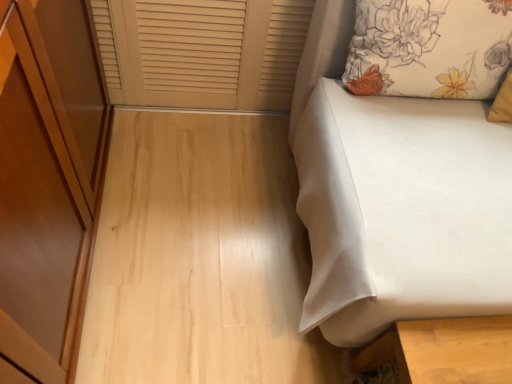
Locate an element on the screen. white fabric bed at right is located at coordinates (395, 198).

What do you see at coordinates (430, 48) in the screenshot?
I see `floral fabric pillow at upper right` at bounding box center [430, 48].

The image size is (512, 384). Identify the location of floral fabric pillow at upper right. (430, 48).

Identify the location of beige wood window frame at upper left. This screenshot has height=384, width=512. (202, 51).

Does point (432, 74) appear closer or farther from the camera than point (305, 128)?

Clearly, point (432, 74) is closer to the camera than point (305, 128).

The height and width of the screenshot is (384, 512). Identify the location of pillow to the left of white fabric bed at right. (430, 48).

Are floral fabric pillow at upper right and white fabric bed at right located far from each other?

floral fabric pillow at upper right is near white fabric bed at right, not far away.

From the image's perspective, which one is positioned higher, floral fabric pillow at upper right or white fabric bed at right?

floral fabric pillow at upper right, from the image's perspective.

Is white fabric bed at right looking in the opposite direction of beige wood window frame at upper left?

No, white fabric bed at right is not facing away from beige wood window frame at upper left.

Between white fabric bed at right and beige wood window frame at upper left, which one appears on the left side from the viewer's perspective?

beige wood window frame at upper left.

Is white fabric bed at right wider or thinner than beige wood window frame at upper left?

white fabric bed at right is wider than beige wood window frame at upper left.

Would you say white fabric bed at right contains beige wood window frame at upper left?

No, beige wood window frame at upper left is located outside of white fabric bed at right.

Is point (220, 99) positioned behind point (327, 177)?

Yes, it is behind point (327, 177).

Consider the image. Which of these two, beige wood window frame at upper left or white fabric bed at right, stands shorter?

beige wood window frame at upper left.

This screenshot has width=512, height=384. Find the location of `furniture below the beige wood window frame at upper left (from the image's perspective)`. furniture below the beige wood window frame at upper left (from the image's perspective) is located at coordinates (395, 198).

Consider the image. Is beige wood window frame at upper left in contact with white fabric bed at right?

beige wood window frame at upper left is not next to white fabric bed at right, and they're not touching.

Does beige wood window frame at upper left come behind floral fabric pillow at upper right?

Yes, it is behind floral fabric pillow at upper right.

Is beige wood window frame at upper left oriented towards floral fabric pillow at upper right?

No, beige wood window frame at upper left is not turned towards floral fabric pillow at upper right.

Looking at this image, from the image's perspective, is beige wood window frame at upper left on top of floral fabric pillow at upper right?

Indeed, from the image's perspective, beige wood window frame at upper left is shown above floral fabric pillow at upper right.

Is floral fabric pillow at upper right located within beige wood window frame at upper left?

Definitely not — floral fabric pillow at upper right is not inside beige wood window frame at upper left.

How far apart are floral fabric pillow at upper right and beige wood window frame at upper left?

The distance of floral fabric pillow at upper right from beige wood window frame at upper left is 54.91 centimeters.

Is floral fabric pillow at upper right situated inside beige wood window frame at upper left or outside?

floral fabric pillow at upper right is not inside beige wood window frame at upper left, it's outside.

How many degrees apart are the facing directions of floral fabric pillow at upper right and beige wood window frame at upper left?

floral fabric pillow at upper right and beige wood window frame at upper left are facing 2.43 degrees away from each other.

From the picture: Considering the relative sizes of floral fabric pillow at upper right and beige wood window frame at upper left in the image provided, is floral fabric pillow at upper right shorter than beige wood window frame at upper left?

Yes.

From the image's perspective, is white fabric bed at right above or below floral fabric pillow at upper right?

white fabric bed at right is below floral fabric pillow at upper right.

From a real-world perspective, relative to floral fabric pillow at upper right, is white fabric bed at right vertically above or below?

In terms of real-world spatial position, white fabric bed at right is below floral fabric pillow at upper right.

How many degrees apart are the facing directions of white fabric bed at right and floral fabric pillow at upper right?

white fabric bed at right and floral fabric pillow at upper right are facing 2.34e-05 degrees away from each other.

From the picture: Is white fabric bed at right looking in the opposite direction of floral fabric pillow at upper right?

Correct, white fabric bed at right is looking away from floral fabric pillow at upper right.

At what (x,y) coordinates should I click in order to perform the action: click on pillow above the white fabric bed at right (from a real-world perspective). Please return your answer as a coordinate pair (x, y). Looking at the image, I should click on point(430,48).

You are a GUI agent. You are given a task and a screenshot of the screen. Output one action in this format:
    pyautogui.click(x=<x>, y=<y>)
    Task: Click on the window frame above the white fabric bed at right (from the image's perspective)
    The width and height of the screenshot is (512, 384).
    Given the screenshot: What is the action you would take?
    pyautogui.click(x=202, y=51)

When comparing their distances from floral fabric pillow at upper right, does beige wood window frame at upper left or white fabric bed at right seem further?

beige wood window frame at upper left lies further to floral fabric pillow at upper right than the other object.

From the image, which object appears to be nearer to white fabric bed at right, floral fabric pillow at upper right or beige wood window frame at upper left?

floral fabric pillow at upper right.

Which object lies nearer to the anchor point floral fabric pillow at upper right, white fabric bed at right or beige wood window frame at upper left?

Based on the image, white fabric bed at right appears to be nearer to floral fabric pillow at upper right.

Considering their positions, is floral fabric pillow at upper right positioned closer to beige wood window frame at upper left than white fabric bed at right?

Based on the image, floral fabric pillow at upper right appears to be nearer to beige wood window frame at upper left.

When comparing their distances from white fabric bed at right, does beige wood window frame at upper left or floral fabric pillow at upper right seem further?

beige wood window frame at upper left is positioned further to the anchor white fabric bed at right.

Looking at the image, which one is located further to beige wood window frame at upper left, white fabric bed at right or floral fabric pillow at upper right?

white fabric bed at right lies further to beige wood window frame at upper left than the other object.

Identify the location of pillow located between beige wood window frame at upper left and white fabric bed at right in the left-right direction. [x=430, y=48].